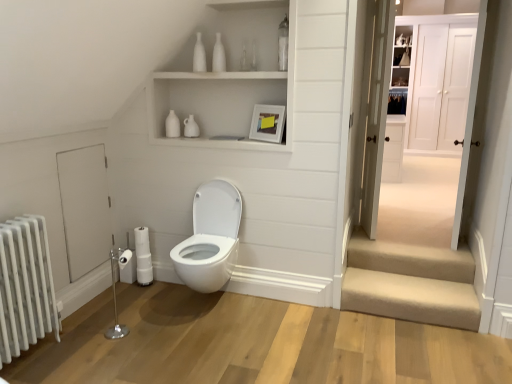
In order to click on vacant space in white wooden door at upper right, which is counted as the third door, starting from the front (from a real-world perspective) in this screenshot , I will do `click(419, 227)`.